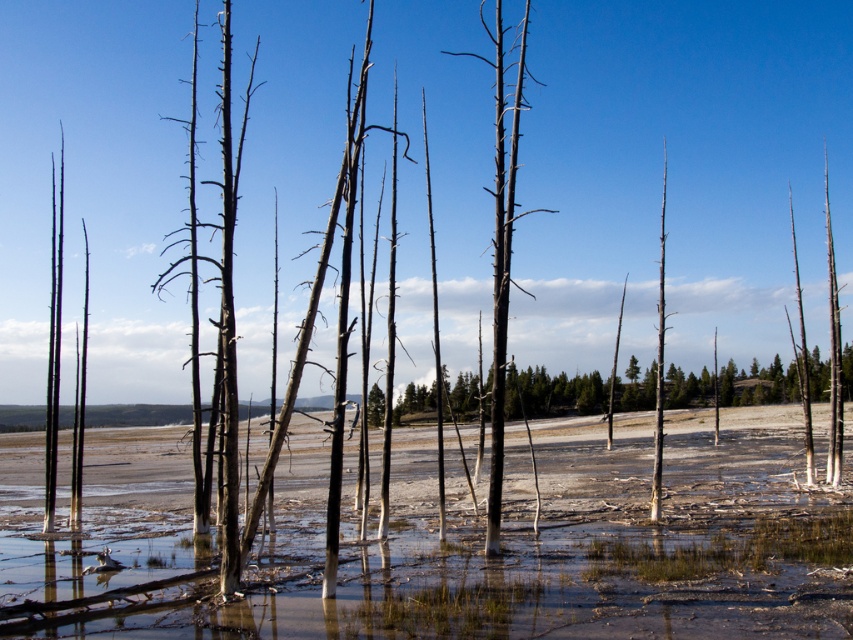
You are a hiker who wants to take a photo of both the charcoal textured tree trunk at center and the smooth gray tree trunk at center. Which tree trunk should you stand closer to in order to capture both in a single frame?

You should stand closer to the smooth gray tree trunk at center because it is shorter than the charcoal textured tree trunk at center. By positioning yourself closer to the shorter tree, you can adjust your camera angle to include both trees within the frame.